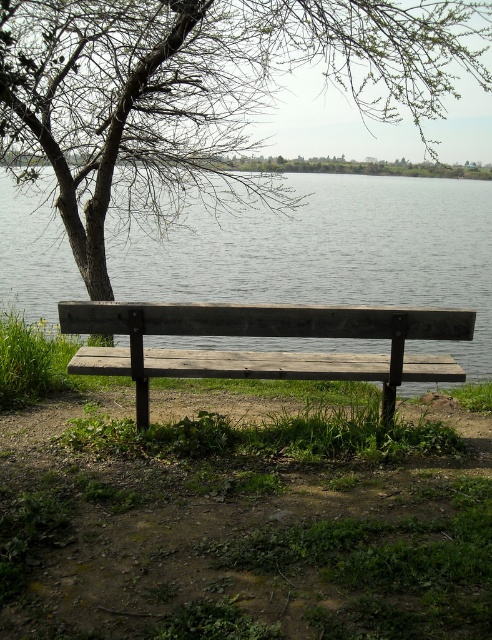
Question: Which object appears farthest from the camera in this image?

Choices:
 (A) gray water at bench right
 (B) weathered wood bench at center
 (C) brown wood tree at upper left

Answer: (A)

Question: Estimate the real-world distances between objects in this image. Which object is closer to the weathered wood bench at center?

Choices:
 (A) brown wood tree at upper left
 (B) gray water at bench right

Answer: (B)

Question: Is gray water at bench right smaller than weathered wood bench at center?

Choices:
 (A) no
 (B) yes

Answer: (A)

Question: Is gray water at bench right positioned behind weathered wood bench at center?

Choices:
 (A) yes
 (B) no

Answer: (A)

Question: Based on their relative distances, which object is nearer to the weathered wood bench at center?

Choices:
 (A) brown wood tree at upper left
 (B) gray water at bench right

Answer: (B)

Question: Observing the image, what is the correct spatial positioning of brown wood tree at upper left in reference to weathered wood bench at center?

Choices:
 (A) left
 (B) right

Answer: (A)